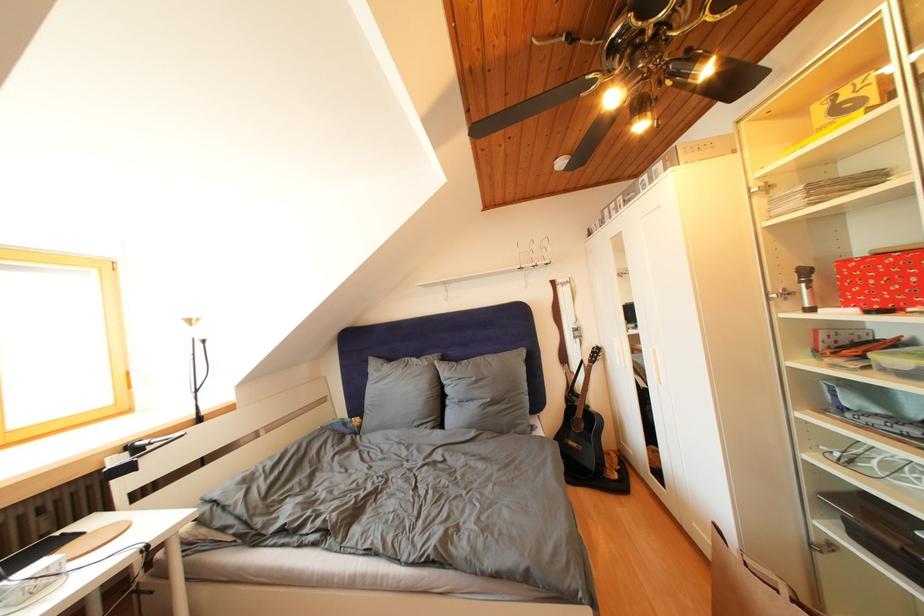
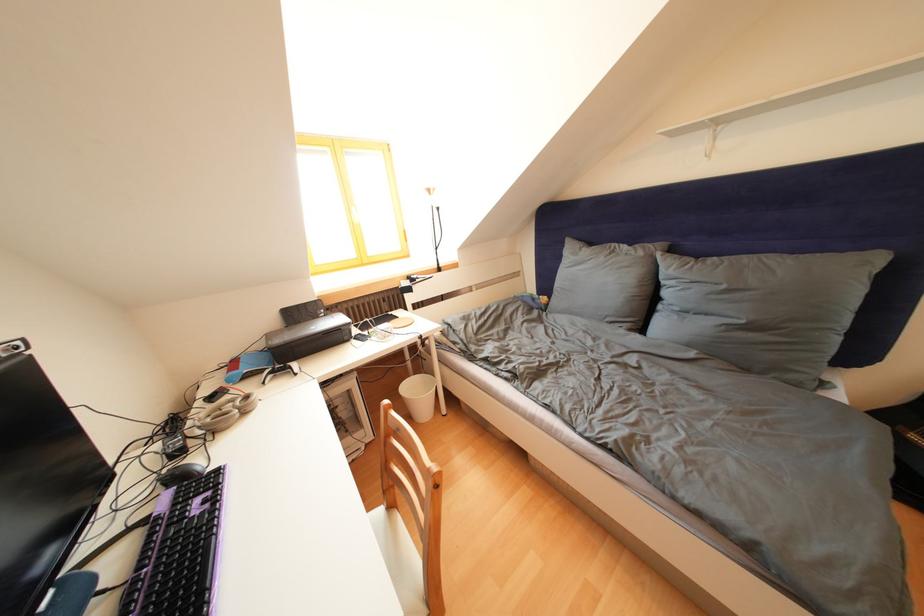
In the second image, find the point that corresponds to (x=433, y=369) in the first image.

(649, 259)